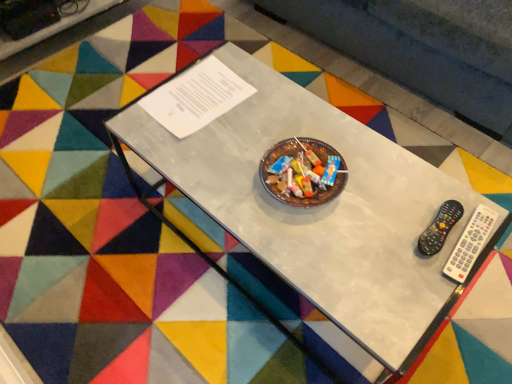
I want to click on vacant space behind black plastic remote at right, so click(403, 181).